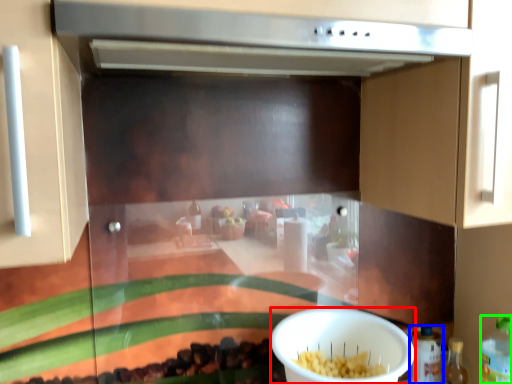
Question: Considering the real-world distances, which object is closest to bowl (highlighted by a red box)? bottle (highlighted by a blue box) or bottle (highlighted by a green box).

Choices:
 (A) bottle
 (B) bottle

Answer: (A)